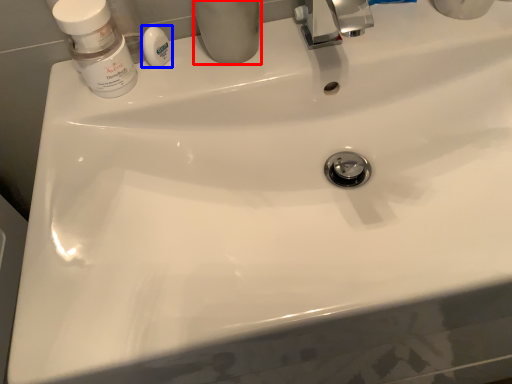
Question: Which point is closer to the camera, toiletry (highlighted by a red box) or soap (highlighted by a blue box)?

Choices:
 (A) toiletry
 (B) soap

Answer: (A)